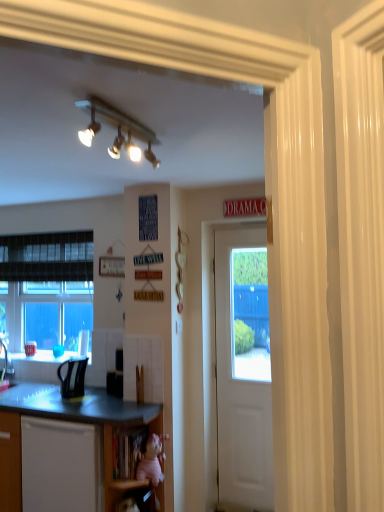
Question: From a real-world perspective, is wooden at lower center, marked as the first shelf in a top-to-bottom arrangement, physically located above or below black laminate countertop at lower left?

Choices:
 (A) above
 (B) below

Answer: (A)

Question: From the image's perspective, is wooden at lower center, which is counted as the 2th shelf, starting from the bottom, located above or below black laminate countertop at lower left?

Choices:
 (A) above
 (B) below

Answer: (A)

Question: Which of these objects is positioned farthest from the matte black kettle at left?

Choices:
 (A) wooden at lower center, marked as the first shelf in a top-to-bottom arrangement
 (B) pink fabric doll at lower center, acting as the 1th shelf starting from the bottom
 (C) black laminate countertop at lower left
 (D) white wooden door at center
 (E) black matte microwave oven at lower center

Answer: (D)

Question: Which object is positioned closest to the white glossy track lights at upper center?

Choices:
 (A) matte black sink at lower left
 (B) wooden at lower center, marked as the first shelf in a top-to-bottom arrangement
 (C) black matte microwave oven at lower center
 (D) black laminate countertop at lower left
 (E) pink fabric doll at lower center, acting as the 1th shelf starting from the bottom

Answer: (C)